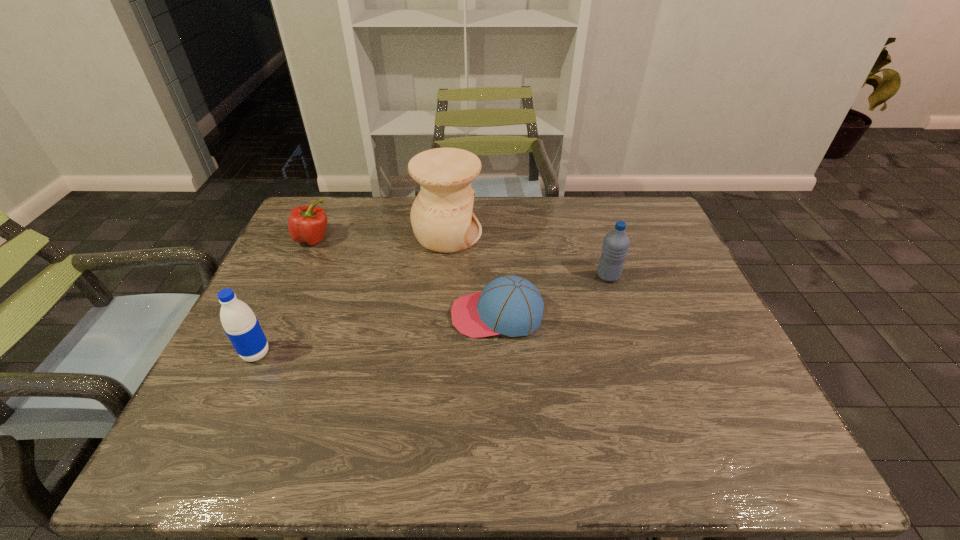
This screenshot has width=960, height=540. In order to click on vacant area that lies between the baseball cap and the nearest object in this screenshot , I will do `click(376, 334)`.

Identify the location of empty space between the baseball cap and the tallest object. (472, 274).

Find the location of a particular element. free space that is in between the left water bottle and the third farthest object is located at coordinates (432, 315).

Locate an element on the screen. vacant space that's between the nearest object and the fourth farthest object is located at coordinates (376, 334).

Locate an element on the screen. Image resolution: width=960 pixels, height=540 pixels. blank region between the right water bottle and the second nearest object is located at coordinates (553, 295).

Where is `object that is the fourth closest to the baseball cap`? object that is the fourth closest to the baseball cap is located at coordinates (307, 224).

Select which object appears as the fourth closest to the left water bottle. Please provide its 2D coordinates. Your answer should be formatted as a tuple, i.e. [(x, y)], where the tuple contains the x and y coordinates of a point satisfying the conditions above.

[(616, 243)]

Identify the location of vacant region that satisfies the following two spatial constraints: 1. on the back side of the right water bottle; 2. at the open side of the tallest object. (594, 234).

Locate an element on the screen. Image resolution: width=960 pixels, height=540 pixels. vacant area in the image that satisfies the following two spatial constraints: 1. at the open side of the pottery; 2. on the front side of the bell pepper is located at coordinates (447, 239).

The height and width of the screenshot is (540, 960). What are the coordinates of `free space that satisfies the following two spatial constraints: 1. on the back side of the third farthest object; 2. on the right side of the nearer water bottle` in the screenshot? It's located at (293, 276).